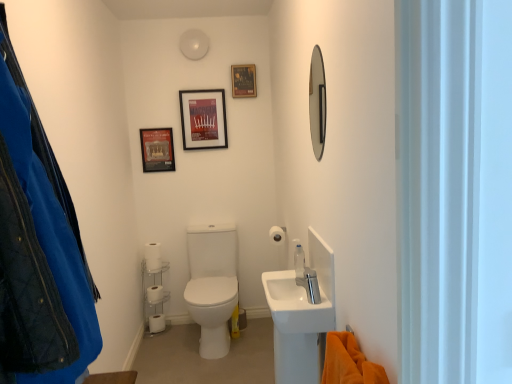
Locate an element on the screen. This screenshot has width=512, height=384. vacant area that is in front of white matte toilet paper at lower left, positioned as the first toilet paper in bottom-to-top order is located at coordinates (152, 335).